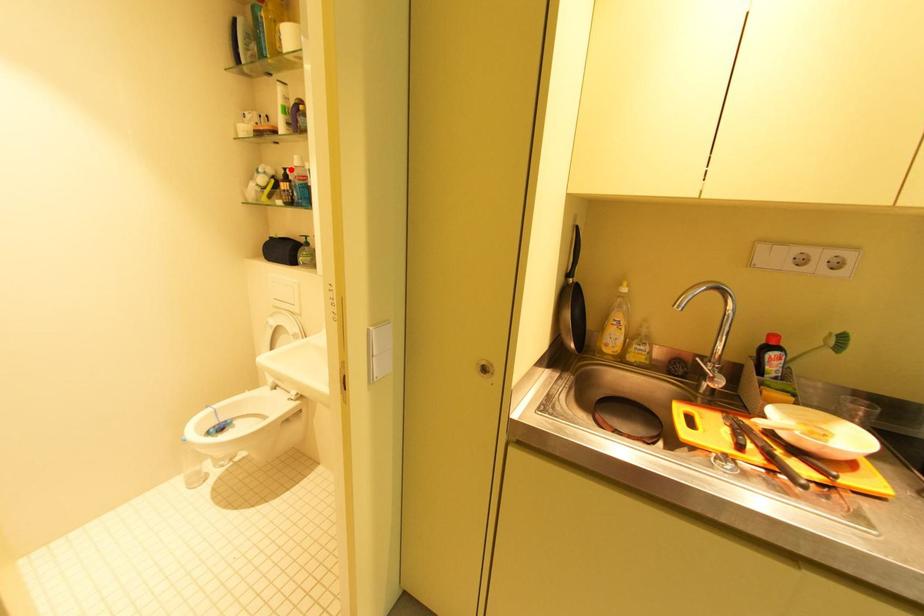
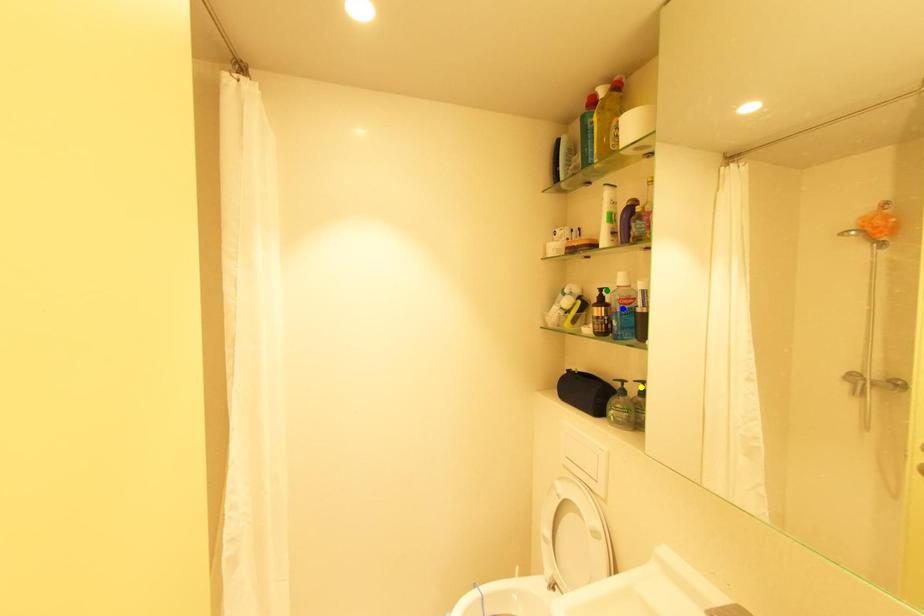
Question: I am providing you with two images of the same scene from different viewpoints. A red point is marked on the first image. You are given multiple points on the second image. In image 2, which mark is for the same physical point as the one in image 1?

Choices:
 (A) green point
 (B) blue point
 (C) yellow point

Answer: (A)